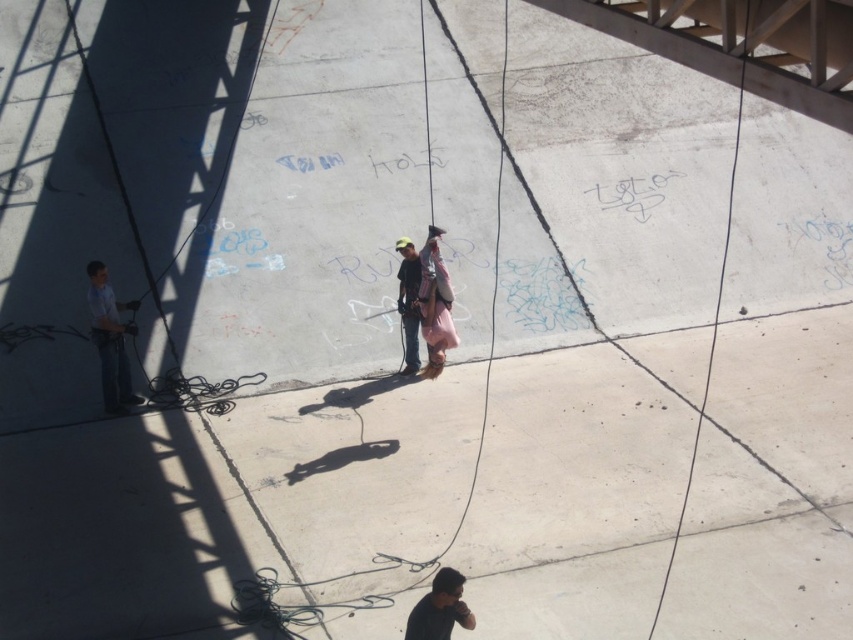
Which of these two, light blue shirt at left or matte black shirt at center, stands taller?

With more height is light blue shirt at left.

Does point (109, 397) come in front of point (408, 326)?

That is True.

The image size is (853, 640). Identify the location of light blue shirt at left. (109, 340).

Between dark gray fabric shirt at lower center and matte black shirt at center, which one appears on the right side from the viewer's perspective?

Positioned to the right is dark gray fabric shirt at lower center.

Describe the element at coordinates (439, 609) in the screenshot. I see `dark gray fabric shirt at lower center` at that location.

Find the location of a particular element. This screenshot has width=853, height=640. dark gray fabric shirt at lower center is located at coordinates (439, 609).

Looking at this image, does pink fabric at center come behind matte black shirt at center?

No, it is in front of matte black shirt at center.

Who is positioned more to the left, pink fabric at center or matte black shirt at center?

matte black shirt at center is more to the left.

At what (x,y) coordinates should I click in order to perform the action: click on pink fabric at center. Please return your answer as a coordinate pair (x, y). This screenshot has width=853, height=640. Looking at the image, I should click on (434, 305).